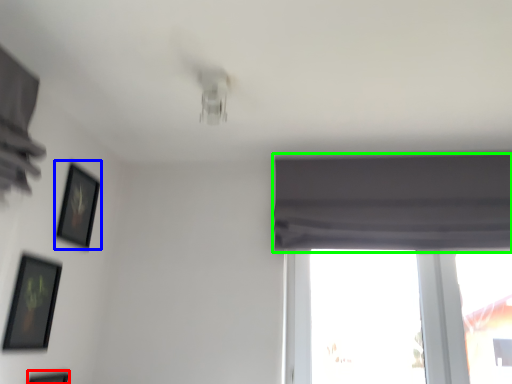
Question: Which object is the closest to the picture frame (highlighted by a red box)? Choose among these: picture frame (highlighted by a blue box) or curtain (highlighted by a green box).

Choices:
 (A) picture frame
 (B) curtain

Answer: (A)